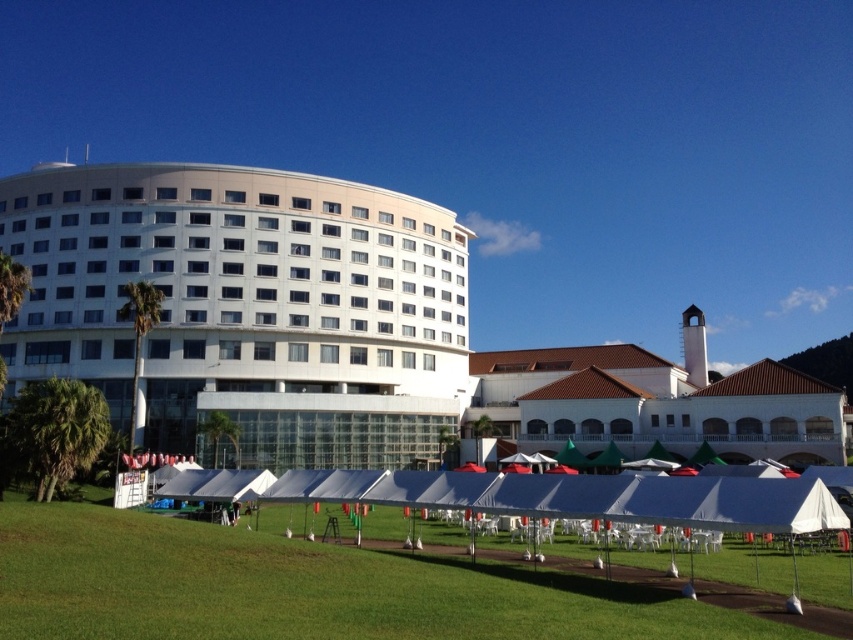
In the scene shown: Is white smooth building at left bigger than white matte building at center?

Yes.

In the scene shown: Is white smooth building at left to the right of white matte building at center from the viewer's perspective?

In fact, white smooth building at left is to the left of white matte building at center.

Which is behind, point (206, 257) or point (556, 349)?

Point (556, 349)

Find the location of a particular element. The width and height of the screenshot is (853, 640). white smooth building at left is located at coordinates (245, 308).

Between white smooth building at left and white fabric tent at lower center, which one has more height?

With more height is white smooth building at left.

Is white smooth building at left bigger than white fabric tent at lower center?

Indeed, white smooth building at left has a larger size compared to white fabric tent at lower center.

Where is `white smooth building at left`? white smooth building at left is located at coordinates (245, 308).

Who is positioned more to the left, white matte building at center or white fabric tent at lower center?

white fabric tent at lower center

Can you confirm if white matte building at center is positioned below white fabric tent at lower center?

Incorrect, white matte building at center is not positioned below white fabric tent at lower center.

Between point (734, 449) and point (734, 528), which one is positioned behind?

The point (734, 449) is behind.

Identify the location of white matte building at center. The width and height of the screenshot is (853, 640). (657, 403).